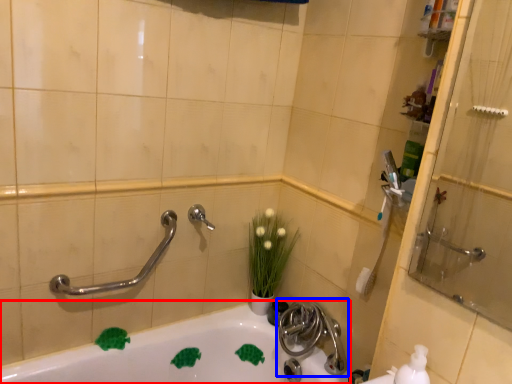
Question: Among these objects, which one is farthest to the camera, bathtub (highlighted by a red box) or tap (highlighted by a blue box)?

Choices:
 (A) bathtub
 (B) tap

Answer: (B)